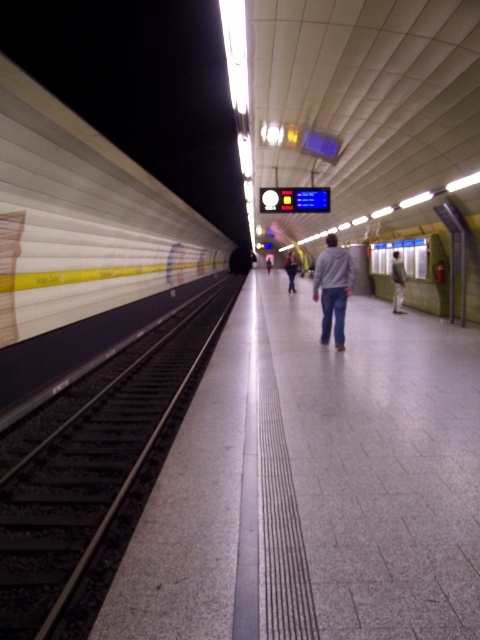
Question: Is white glossy platform at left bigger than light blue jeans at center?

Choices:
 (A) no
 (B) yes

Answer: (B)

Question: Can you confirm if gray hoodie at center is smaller than light brown fabric pants at center?

Choices:
 (A) yes
 (B) no

Answer: (B)

Question: Among these points, which one is nearest to the camera?

Choices:
 (A) (88, 506)
 (B) (43, 330)

Answer: (A)

Question: Which point is farther from the camera taking this photo?

Choices:
 (A) (395, 296)
 (B) (337, 278)
 (C) (2, 515)

Answer: (A)

Question: Can you confirm if black metal train track at left is positioned above gray hoodie at center?

Choices:
 (A) no
 (B) yes

Answer: (A)

Question: Which point appears farthest from the camera in this image?

Choices:
 (A) [x=39, y=296]
 (B) [x=0, y=460]
 (C) [x=295, y=269]

Answer: (C)